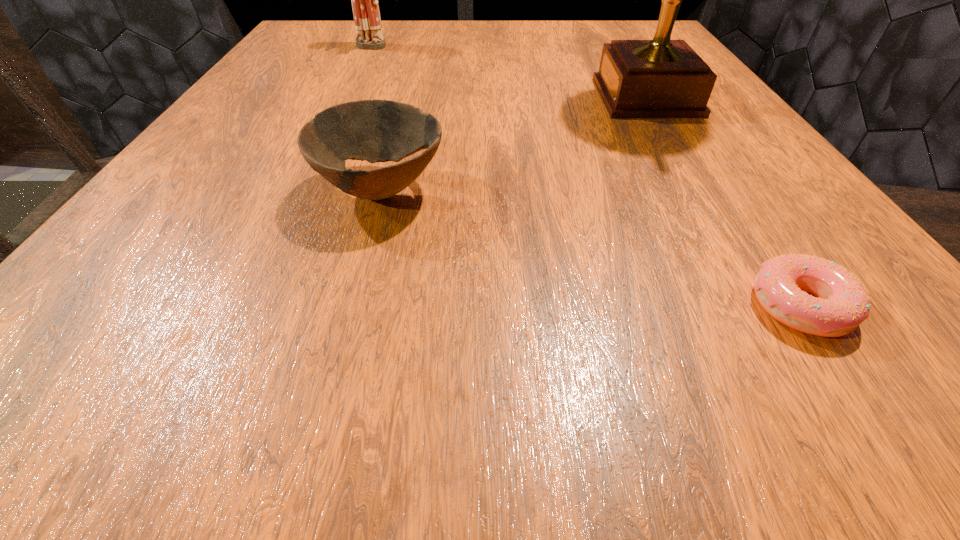
Locate an element on the screen. The image size is (960, 540). the tallest object is located at coordinates (661, 78).

Where is `the third nearest object`? This screenshot has width=960, height=540. the third nearest object is located at coordinates (661, 78).

The height and width of the screenshot is (540, 960). Find the location of `the second tallest object`. the second tallest object is located at coordinates (366, 13).

At what (x,y) coordinates should I click in order to perform the action: click on the farthest object. Please return your answer as a coordinate pair (x, y). Looking at the image, I should click on click(366, 13).

Where is `bowl`? This screenshot has height=540, width=960. bowl is located at coordinates (375, 130).

You are a GUI agent. You are given a task and a screenshot of the screen. Output one action in this format:
    pyautogui.click(x=<x>, y=<y>)
    Task: Click on the second shortest object
    
    Given the screenshot: What is the action you would take?
    pyautogui.click(x=375, y=130)

Locate an element on the screen. the nearest object is located at coordinates (843, 303).

This screenshot has width=960, height=540. Find the location of `doughnut`. doughnut is located at coordinates (843, 303).

The image size is (960, 540). I want to click on free space located on the plaque of the award, so click(x=511, y=97).

Where is `vacant space located 0.130m on the plaque of the award`? This screenshot has height=540, width=960. vacant space located 0.130m on the plaque of the award is located at coordinates (522, 97).